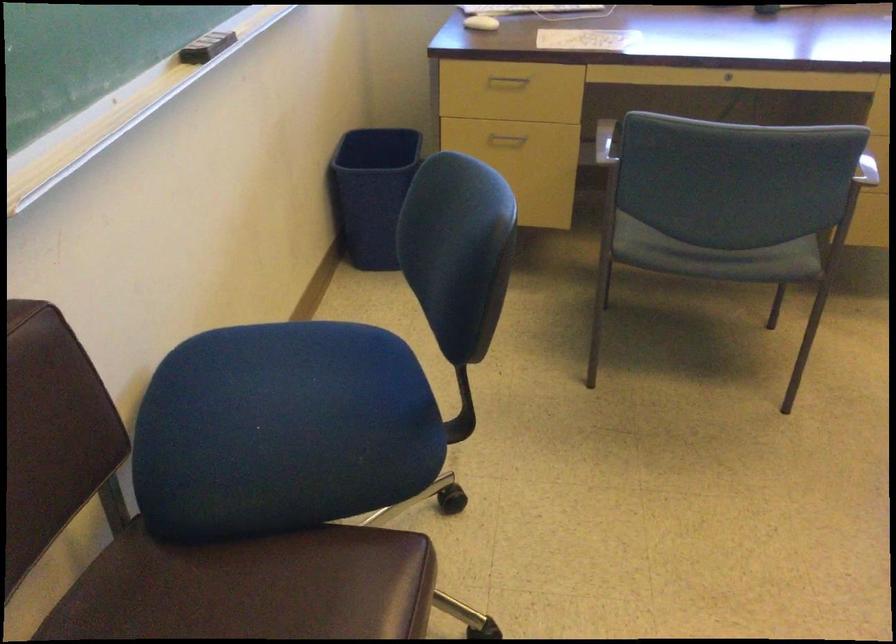
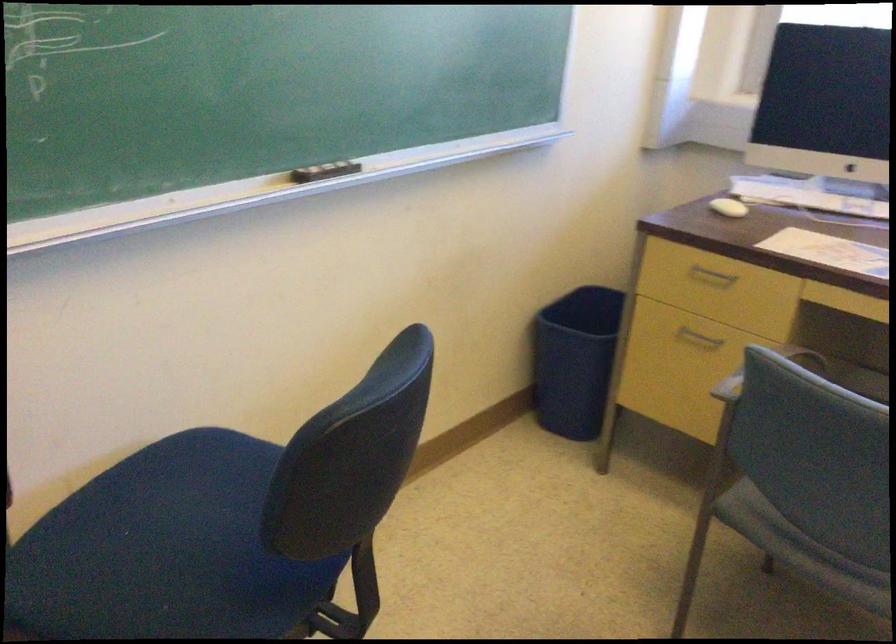
Where in the second image is the point corresponding to point 679,256 from the first image?

(800, 549)